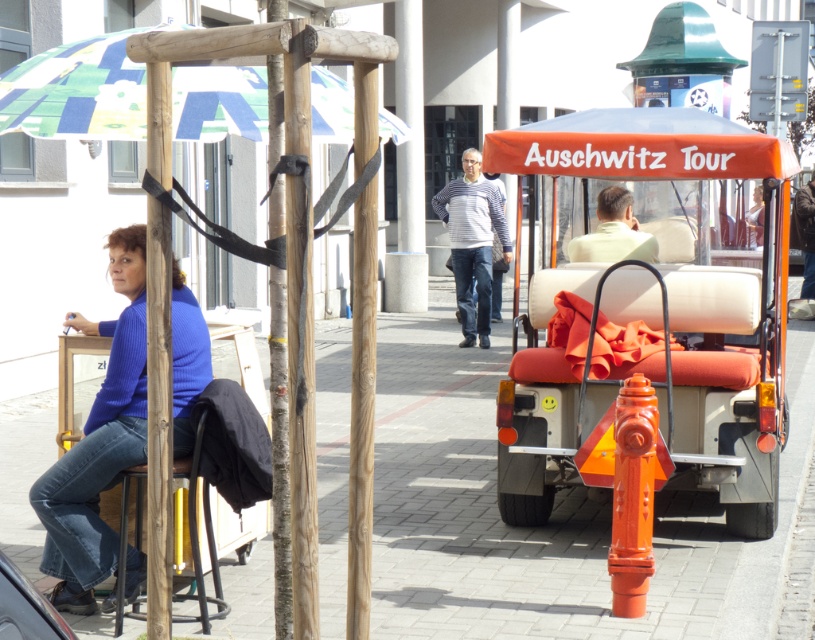
Consider the image. You are standing at the point marked as point (77, 90) in the image. What object is located at that point?

The point (77, 90) corresponds to the printed fabric umbrella at upper left.

You are standing at the viewpoint of the image and want to place a small sticker on either the point at coordinates point (x=178, y=131) or the point at coordinates point (x=589, y=241). Which point is closer to you?

The point at coordinates point (x=178, y=131) is closer to the viewer than the point at coordinates point (x=589, y=241).